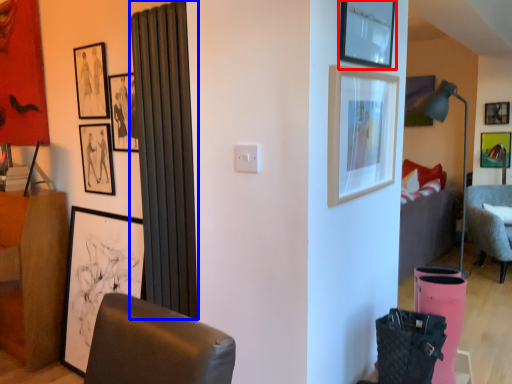
Question: Which of the following is the farthest to the observer, picture frame (highlighted by a red box) or curtain (highlighted by a blue box)?

Choices:
 (A) picture frame
 (B) curtain

Answer: (B)